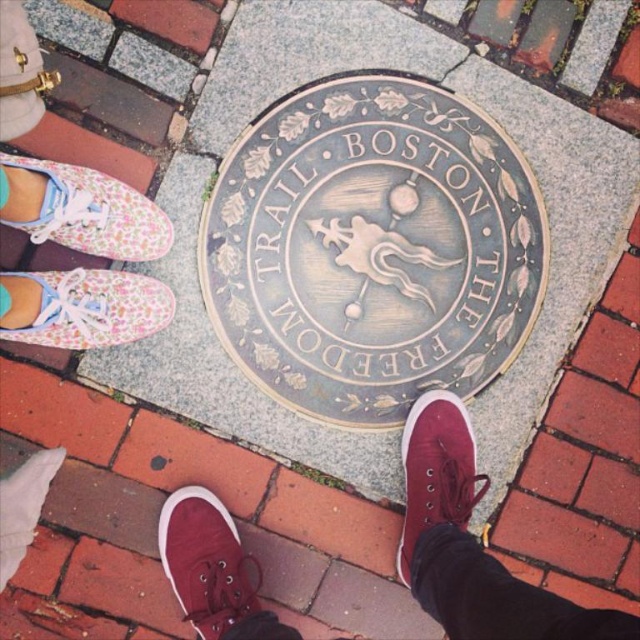
Can you confirm if matte canvas sneaker at center is positioned below floral fabric shoe at lower left?

Yes.

Who is positioned more to the right, matte canvas sneaker at center or floral fabric shoe at lower left?

From the viewer's perspective, matte canvas sneaker at center appears more on the right side.

Between point (412, 556) and point (76, 316), which one is positioned behind?

The point (412, 556) is more distant.

Locate an element on the screen. This screenshot has height=640, width=640. matte canvas sneaker at center is located at coordinates (436, 470).

Is matte canvas shoes at center to the right of matte canvas sneaker at lower center from the viewer's perspective?

Correct, you'll find matte canvas shoes at center to the right of matte canvas sneaker at lower center.

Where is `matte canvas shoes at center`? This screenshot has height=640, width=640. matte canvas shoes at center is located at coordinates (472, 545).

Does point (464, 467) lie behind point (196, 589)?

Yes, it is behind point (196, 589).

The width and height of the screenshot is (640, 640). Find the location of `matte canvas shoes at center`. matte canvas shoes at center is located at coordinates (472, 545).

Does bronze textured medallion at center come behind floral fabric shoe at lower left?

Yes, bronze textured medallion at center is further from the viewer.

Does bronze textured medallion at center appear under floral fabric shoe at lower left?

No.

Between point (243, 189) and point (138, 330), which one is positioned behind?

The point (243, 189) is behind.

Where is `bronze textured medallion at center`? This screenshot has height=640, width=640. bronze textured medallion at center is located at coordinates (371, 248).